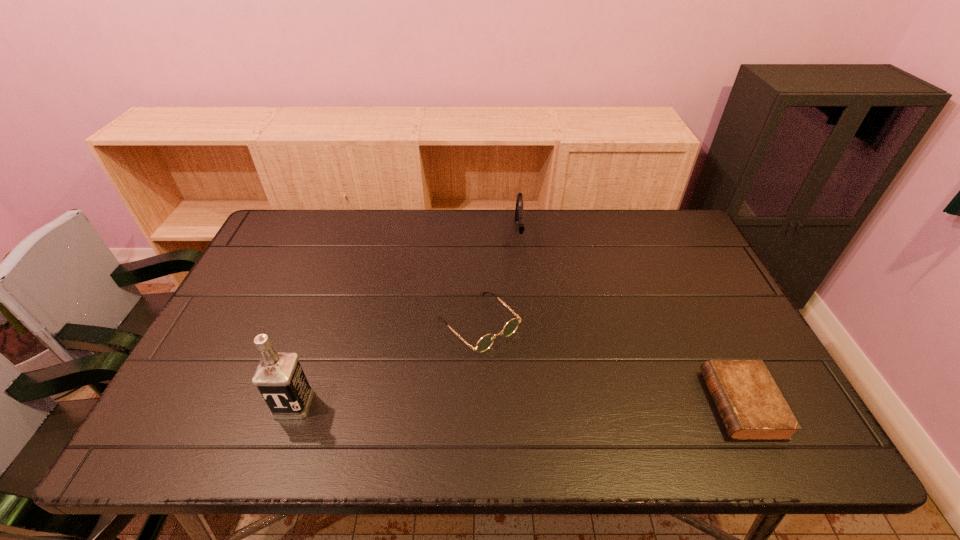
Image resolution: width=960 pixels, height=540 pixels. Find the location of `object that is at the near right corner`. object that is at the near right corner is located at coordinates (750, 404).

The image size is (960, 540). In the image, there is a desktop. Find the location of `blank space at the far edge`. blank space at the far edge is located at coordinates pos(459,226).

I want to click on free spot at the near edge of the desktop, so click(259, 408).

Identify the location of free location at the left edge. The height and width of the screenshot is (540, 960). (264, 319).

At what (x,y) coordinates should I click in order to perform the action: click on vacant space at the right edge of the desktop. Please return your answer as a coordinate pair (x, y). This screenshot has height=540, width=960. Looking at the image, I should click on (681, 264).

Where is `free region at the near left corner of the desktop`? Image resolution: width=960 pixels, height=540 pixels. free region at the near left corner of the desktop is located at coordinates (219, 394).

At what (x,y) coordinates should I click in order to perform the action: click on free area in between the rightmost object and the third shortest object. Please return your answer as a coordinate pair (x, y). Looking at the image, I should click on (631, 319).

This screenshot has height=540, width=960. Identify the location of vacant space in between the rightmost object and the third object from right to left. (611, 363).

Image resolution: width=960 pixels, height=540 pixels. Identify the location of free space between the diary and the gun. (631, 319).

Locate an element on the screen. The image size is (960, 540). vacant space that's between the second farthest object and the farthest object is located at coordinates (499, 279).